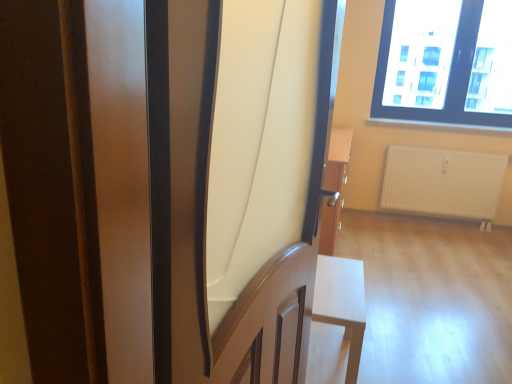
Question: Is white matte radiator at lower right positioned before matte wood screen door at center?

Choices:
 (A) yes
 (B) no

Answer: (B)

Question: Is white matte radiator at lower right oriented away from matte wood screen door at center?

Choices:
 (A) no
 (B) yes

Answer: (A)

Question: Is white matte radiator at lower right at the right side of matte wood screen door at center?

Choices:
 (A) yes
 (B) no

Answer: (A)

Question: From the image's perspective, is white matte radiator at lower right under matte wood screen door at center?

Choices:
 (A) yes
 (B) no

Answer: (B)

Question: Does white matte radiator at lower right have a smaller size compared to matte wood screen door at center?

Choices:
 (A) yes
 (B) no

Answer: (A)

Question: Are white matte radiator at lower right and matte wood screen door at center beside each other?

Choices:
 (A) yes
 (B) no

Answer: (B)

Question: Is white matte radiator at lower right shorter than transparent glass window at upper right?

Choices:
 (A) yes
 (B) no

Answer: (A)

Question: Does white matte radiator at lower right appear on the left side of transparent glass window at upper right?

Choices:
 (A) yes
 (B) no

Answer: (B)

Question: Is white matte radiator at lower right behind transparent glass window at upper right?

Choices:
 (A) no
 (B) yes

Answer: (B)

Question: Considering the relative sizes of white matte radiator at lower right and transparent glass window at upper right in the image provided, is white matte radiator at lower right thinner than transparent glass window at upper right?

Choices:
 (A) yes
 (B) no

Answer: (A)

Question: From a real-world perspective, is white matte radiator at lower right located higher than transparent glass window at upper right?

Choices:
 (A) yes
 (B) no

Answer: (B)

Question: Can you confirm if white matte radiator at lower right is wider than transparent glass window at upper right?

Choices:
 (A) yes
 (B) no

Answer: (B)

Question: Is matte wood screen door at center to the left of transparent glass window at upper right from the viewer's perspective?

Choices:
 (A) no
 (B) yes

Answer: (B)